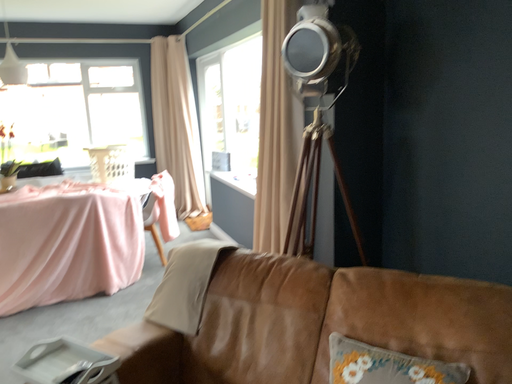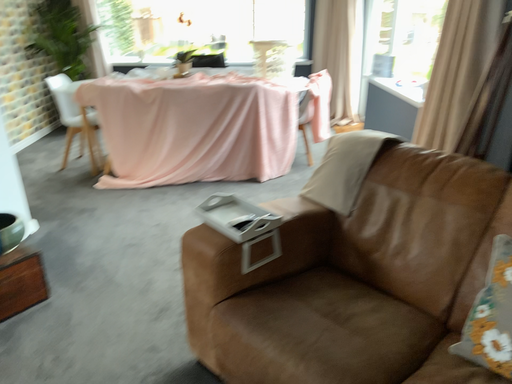
Question: How did the camera likely rotate when shooting the video?

Choices:
 (A) rotated upward
 (B) rotated downward

Answer: (B)